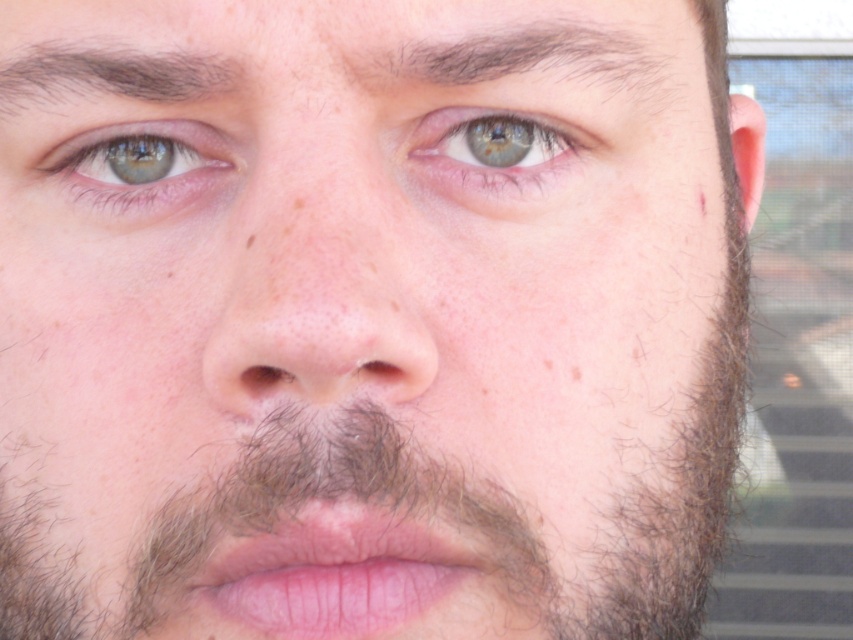
Question: Does blue matte eye at center have a smaller size compared to green matte eye at upper left?

Choices:
 (A) no
 (B) yes

Answer: (B)

Question: Which object is the farthest from the green matte eye at upper left?

Choices:
 (A) blue matte eye at center
 (B) dark brown hair at upper center
 (C) dark brown hair at upper left

Answer: (B)

Question: Which of these objects is positioned farthest from the dark brown hair at upper left?

Choices:
 (A) green matte eye at upper left
 (B) blue matte eye at center
 (C) smooth skin nose at center

Answer: (B)

Question: Is dark brown hair at upper center further to the viewer compared to green matte eye at upper left?

Choices:
 (A) no
 (B) yes

Answer: (A)

Question: Does smooth skin nose at center have a lesser width compared to green matte eye at upper left?

Choices:
 (A) no
 (B) yes

Answer: (A)

Question: Which object is positioned farthest from the dark brown hair at upper left?

Choices:
 (A) smooth skin nose at center
 (B) green matte eye at upper left
 (C) blue matte eye at center

Answer: (C)